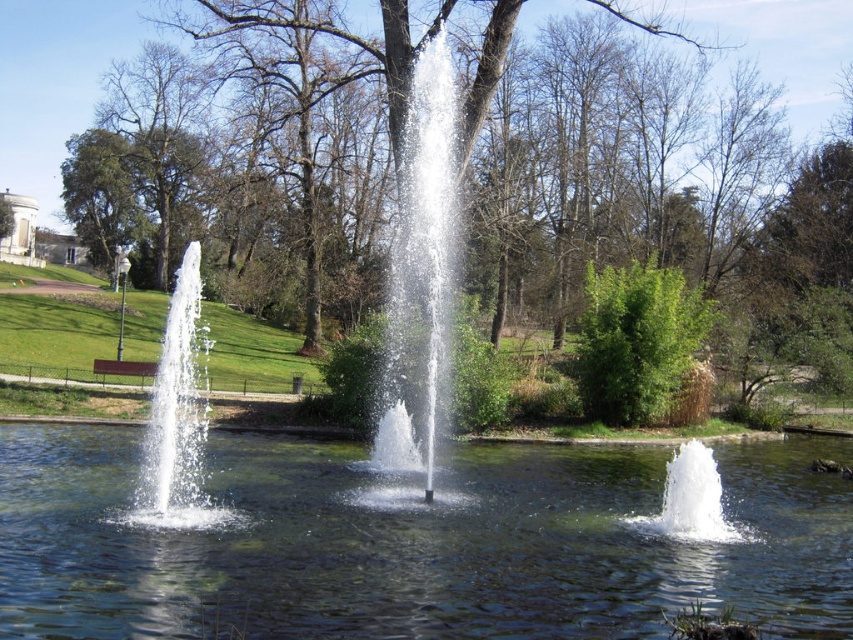
In the scene shown: You are standing at the point marked by the coordinates (x=648, y=180) in the park. What object is exactly at this location?

The green leafy tree at center is located at point (x=648, y=180).